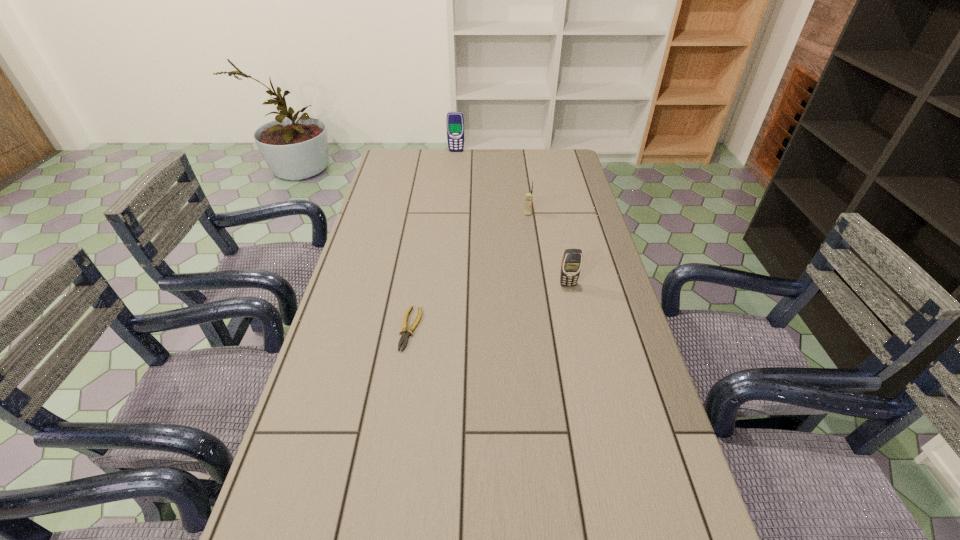
Locate an element on the screen. The width and height of the screenshot is (960, 540). free area in between the tallest cellular telephone and the second farthest object is located at coordinates (492, 183).

Locate an element on the screen. free space between the second nearest object and the second object from right to left is located at coordinates (548, 249).

This screenshot has height=540, width=960. Identify the location of free space between the rightmost cellular telephone and the nearest object. (489, 307).

You are a GUI agent. You are given a task and a screenshot of the screen. Output one action in this format:
    pyautogui.click(x=<x>, y=<y>)
    Task: Click on the vacant area between the rightmost object and the pliers
    This screenshot has height=540, width=960.
    Given the screenshot: What is the action you would take?
    pyautogui.click(x=489, y=307)

Where is `free space between the leftmost cellular telephone and the rightmost object`? Image resolution: width=960 pixels, height=540 pixels. free space between the leftmost cellular telephone and the rightmost object is located at coordinates pyautogui.click(x=512, y=218).

Where is `free area in between the second cellular telephone from right to left and the rightmost cellular telephone`? This screenshot has width=960, height=540. free area in between the second cellular telephone from right to left and the rightmost cellular telephone is located at coordinates (548, 249).

Locate an element on the screen. free point between the shortest object and the second farthest object is located at coordinates (469, 272).

Find the location of a particular element. This screenshot has height=540, width=960. free area in between the shortest object and the third object from left to right is located at coordinates (469, 272).

Identify which object is the second nearest to the third nearest object. Please provide its 2D coordinates. Your answer should be formatted as a tuple, i.e. [(x, y)], where the tuple contains the x and y coordinates of a point satisfying the conditions above.

[(455, 121)]

At what (x,y) coordinates should I click in order to perform the action: click on object that ranks as the third closest to the second cellular telephone from left to right. Please return your answer as a coordinate pair (x, y). The image size is (960, 540). Looking at the image, I should click on pos(405,333).